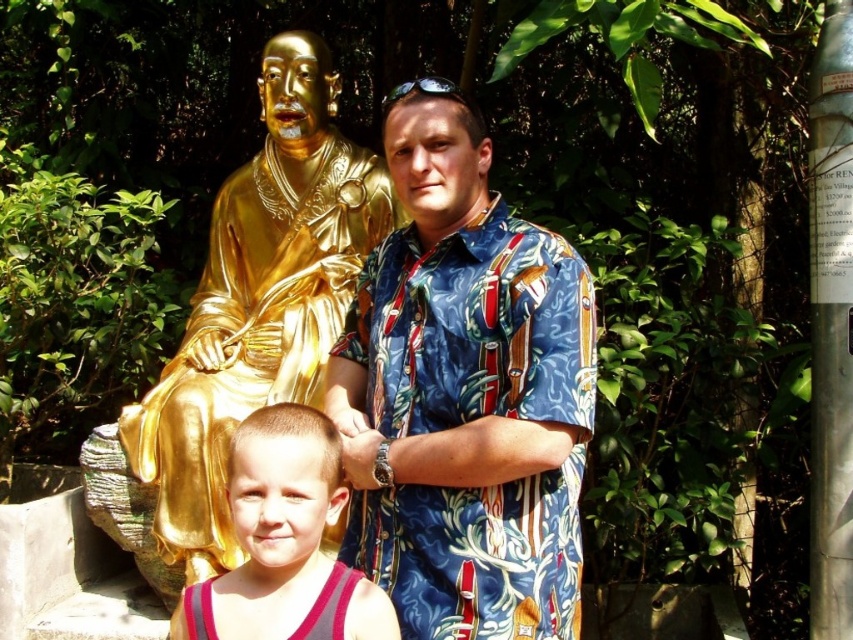
Does blue printed shirt at center have a lesser width compared to matte pink tank top at center?

No, blue printed shirt at center is not thinner than matte pink tank top at center.

Which of these two, blue printed shirt at center or matte pink tank top at center, stands shorter?

matte pink tank top at center is shorter.

I want to click on blue printed shirt at center, so 471,420.

Identify the location of blue printed shirt at center. (471, 420).

Which is behind, point (196, 604) or point (329, 605)?

The point (196, 604) is more distant.

Is matte pink tank top at center smaller than pink fabric tank top at lower center?

No, matte pink tank top at center is not smaller than pink fabric tank top at lower center.

What do you see at coordinates (283, 541) in the screenshot? I see `matte pink tank top at center` at bounding box center [283, 541].

The width and height of the screenshot is (853, 640). What are the coordinates of `matte pink tank top at center` in the screenshot? It's located at (283, 541).

Between point (183, 428) and point (318, 608), which one is positioned in front?

Point (318, 608) is more forward.

Does gold shiny statue at upper left come behind pink fabric tank top at lower center?

Yes, it is.

Find the location of `gold shiny statue at upper left`. gold shiny statue at upper left is located at coordinates (244, 323).